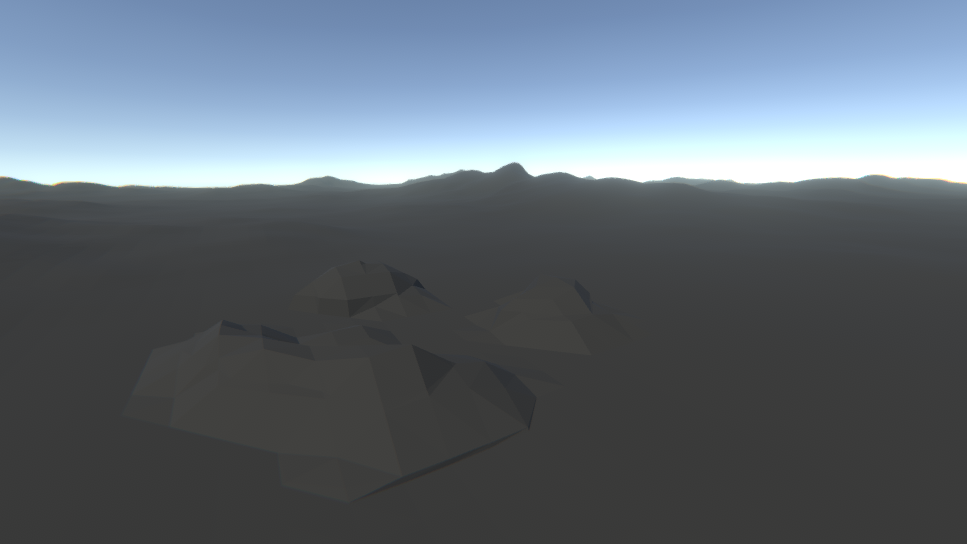
This screenshot has height=544, width=967. I want to click on light, so click(649, 172).